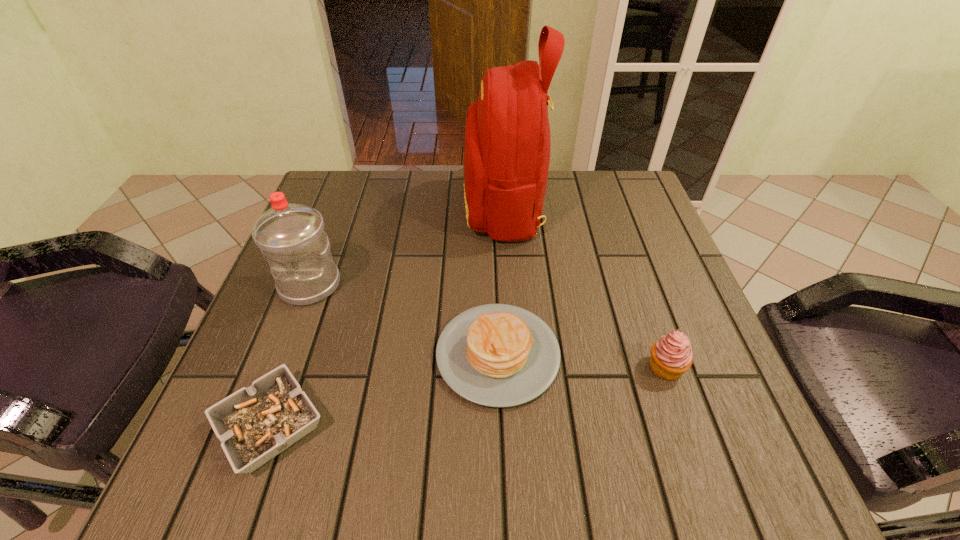
The width and height of the screenshot is (960, 540). Identify the location of the tallest object. (507, 146).

The image size is (960, 540). What are the coordinates of `the farthest object` in the screenshot? It's located at (507, 146).

Find the location of `water bottle`. water bottle is located at coordinates tap(291, 237).

Identify the location of cupcake. (671, 356).

This screenshot has height=540, width=960. In order to click on the third shortest object in this screenshot , I will do `click(671, 356)`.

This screenshot has width=960, height=540. In order to click on pancake in this screenshot , I will do `click(497, 355)`.

Identify the location of the shortest object. Image resolution: width=960 pixels, height=540 pixels. [254, 424].

In order to click on free space located 0.120m on the front-facing side of the backpack in this screenshot , I will do `click(418, 207)`.

The height and width of the screenshot is (540, 960). Find the location of `vacant space positioned 0.240m on the front-facing side of the backpack`. vacant space positioned 0.240m on the front-facing side of the backpack is located at coordinates (x=371, y=207).

Locate an element on the screen. The image size is (960, 540). free region located on the front-facing side of the backpack is located at coordinates click(327, 207).